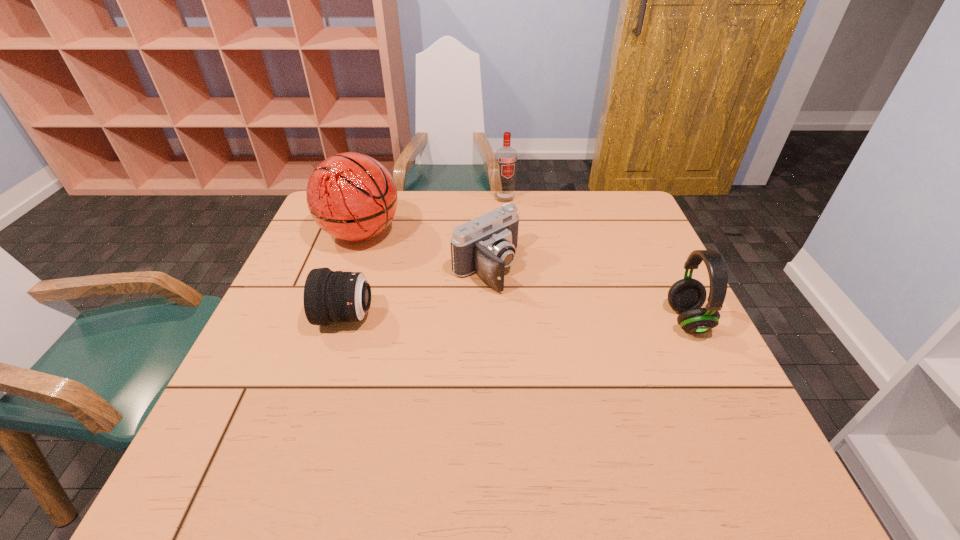
Where is `telephoto lens`? telephoto lens is located at coordinates (329, 296).

Locate an element on the screen. This screenshot has height=540, width=960. headset is located at coordinates (686, 296).

What are the coordinates of `the rightmost object` in the screenshot? It's located at (686, 296).

Where is `basketball`? The image size is (960, 540). basketball is located at coordinates (351, 196).

You are a GUI agent. You are given a task and a screenshot of the screen. Output one action in this format:
    pyautogui.click(x=<x>, y=<y>)
    Task: Click on the camera
    This screenshot has width=960, height=540.
    Given the screenshot: What is the action you would take?
    pyautogui.click(x=486, y=245)

At what (x,y) coordinates should I click in order to perform the action: click on vodka. Please return your answer as a coordinate pair (x, y). This screenshot has height=540, width=960. Looking at the image, I should click on (506, 157).

Where is `vacant space located 0.110m at the front element of the telephoto lens`? The image size is (960, 540). vacant space located 0.110m at the front element of the telephoto lens is located at coordinates (275, 317).

Locate an element on the screen. The height and width of the screenshot is (540, 960). free space located 0.100m at the front element of the telephoto lens is located at coordinates (279, 317).

In order to click on free space located 0.120m at the front element of the telephoto lens in this screenshot , I will do `click(271, 317)`.

The height and width of the screenshot is (540, 960). What are the coordinates of `vacant space located 0.100m on the side with spill of the basketball` in the screenshot? It's located at (411, 265).